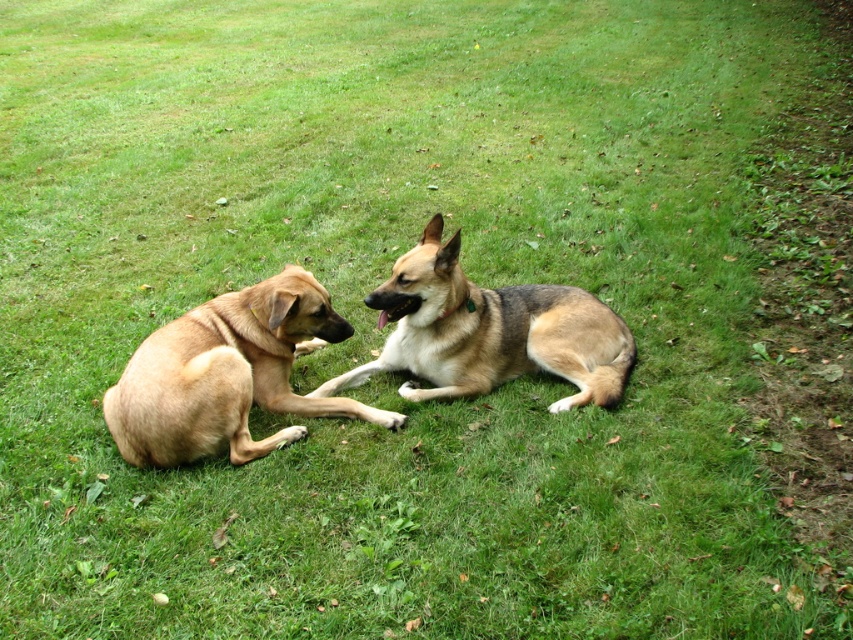
Does point (160, 403) come closer to viewer compared to point (526, 346)?

Yes, point (160, 403) is closer to viewer.

Does golden fur dog at left have a smaller size compared to brown fur dog at center?

Indeed, golden fur dog at left has a smaller size compared to brown fur dog at center.

Is point (306, 301) farther from camera compared to point (434, 333)?

No, (306, 301) is closer to viewer.

This screenshot has height=640, width=853. Identify the location of golden fur dog at left. 228,374.